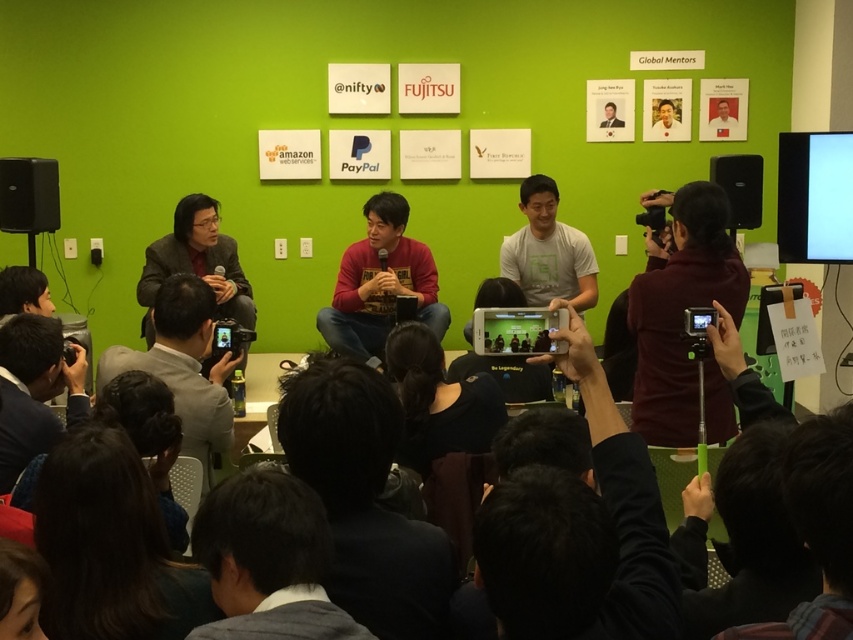
You are an attendee at the event and want to take a photo of the panel members. You are standing at point (714, 156). There is another attendee at point (421, 262). Which attendee is closer to the panel stage?

The attendee at point (714, 156) is closer to the panel stage because point (421, 262) is behind it, meaning the attendee at (714, 156) is in front and thus nearer to the stage.